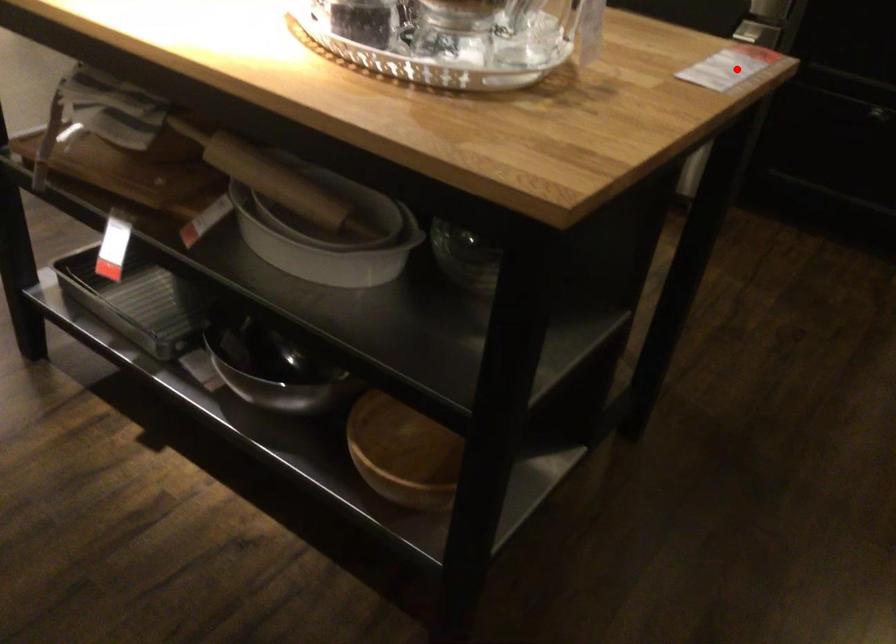
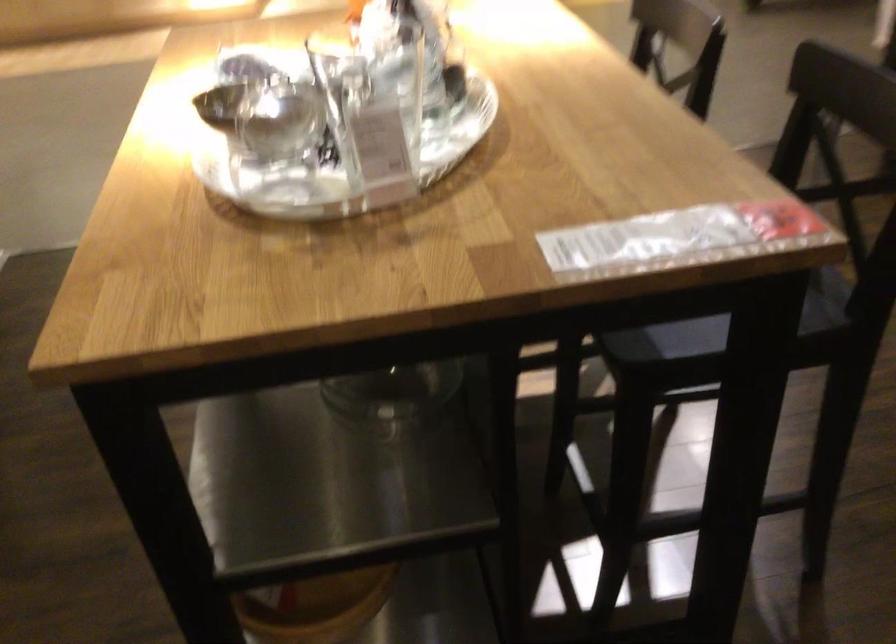
The point at the highlighted location is marked in the first image. Where is the corresponding point in the second image?

(676, 238)